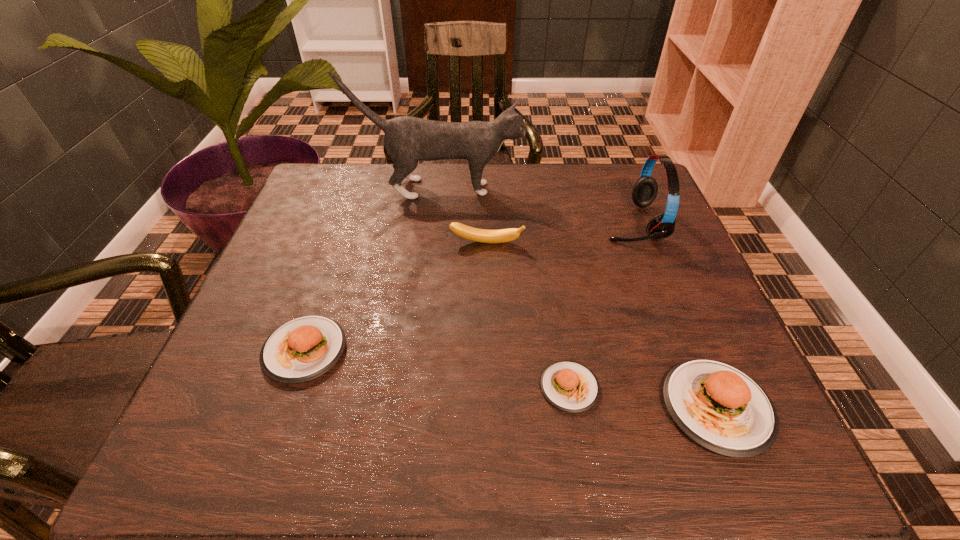
You are a GUI agent. You are given a task and a screenshot of the screen. Output one action in this format:
    pyautogui.click(x=<x>, y=<y>)
    Task: Click on the free point between the second shortest food and the banana
    Image resolution: width=960 pixels, height=540 pixels.
    Given the screenshot: What is the action you would take?
    pyautogui.click(x=396, y=297)

The width and height of the screenshot is (960, 540). I want to click on vacant area that lies between the rightmost food and the banana, so click(602, 326).

Select which object appears as the third closest to the cat. Please provide its 2D coordinates. Your answer should be formatted as a tuple, i.e. [(x, y)], where the tuple contains the x and y coordinates of a point satisfying the conditions above.

[(302, 349)]

Identify which object is the second closest to the leftmost food. Please provide its 2D coordinates. Your answer should be formatted as a tuple, i.e. [(x, y)], where the tuple contains the x and y coordinates of a point satisfying the conditions above.

[(570, 386)]

Locate which food is the third closest to the banana. Please provide its 2D coordinates. Your answer should be formatted as a tuple, i.e. [(x, y)], where the tuple contains the x and y coordinates of a point satisfying the conditions above.

[(721, 408)]

What are the coordinates of `the closest food to the banana` in the screenshot? It's located at (302, 349).

Where is `free spot that satisfies the following two spatial constraints: 1. at the face of the tallest object; 2. on the left side of the rightmost food`? Image resolution: width=960 pixels, height=540 pixels. free spot that satisfies the following two spatial constraints: 1. at the face of the tallest object; 2. on the left side of the rightmost food is located at coordinates (413, 408).

The width and height of the screenshot is (960, 540). Identify the location of vacant space that satisfies the following two spatial constraints: 1. with the microphone attached to the side of the headset; 2. on the front side of the leftmost food. (683, 350).

Where is `free space that satisfies the following two spatial constraints: 1. at the face of the tallest object; 2. on the right side of the second food from right to left`? Image resolution: width=960 pixels, height=540 pixels. free space that satisfies the following two spatial constraints: 1. at the face of the tallest object; 2. on the right side of the second food from right to left is located at coordinates (415, 387).

The height and width of the screenshot is (540, 960). What are the coordinates of `free space that satisfies the following two spatial constraints: 1. on the back side of the rightmost food; 2. at the face of the tallest object` in the screenshot? It's located at (626, 188).